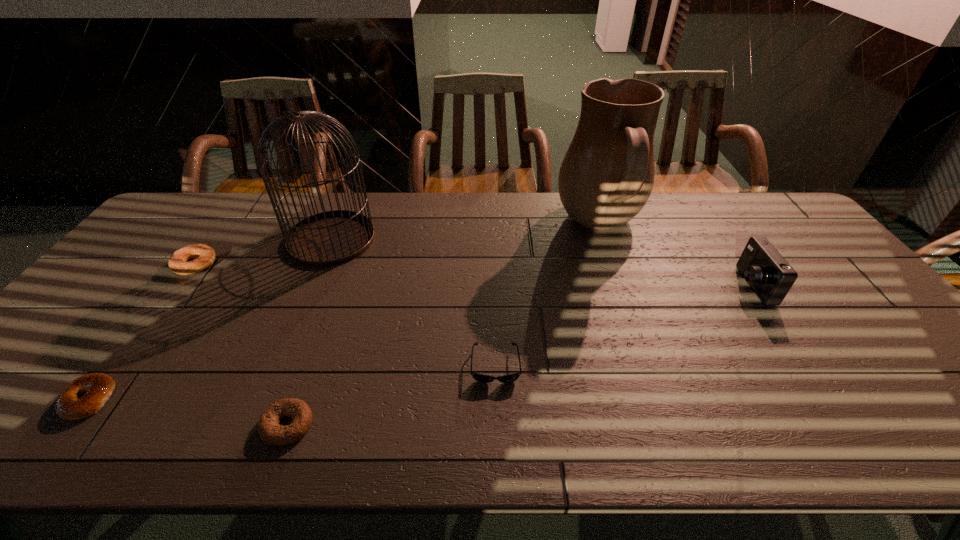
This screenshot has width=960, height=540. Find the location of `cream pitcher`. cream pitcher is located at coordinates (607, 175).

You are a GUI agent. You are given a task and a screenshot of the screen. Output one action in this format:
    pyautogui.click(x=<x>, y=<y>)
    Task: Click on the birdcage
    
    Given the screenshot: What is the action you would take?
    pyautogui.click(x=329, y=238)

Locate an element on the screen. the third tallest object is located at coordinates (770, 276).

Locate an element on the screen. the rightmost object is located at coordinates (770, 276).

Find the location of `the tallest bagel`. the tallest bagel is located at coordinates (205, 255).

At what (x,y) coordinates should I click in order to perform the action: click on sunglasses. Please return your answer as a coordinate pair (x, y). Looking at the image, I should click on (482, 378).

At what (x,y) coordinates should I click in order to perform the action: click on the rightmost bagel. Please return your answer as a coordinate pair (x, y). The image size is (960, 540). Looking at the image, I should click on (269, 430).

Where is `free space located at the spout of the cream pitcher`? The height and width of the screenshot is (540, 960). free space located at the spout of the cream pitcher is located at coordinates (526, 227).

Identify the location of vacant space situated at the spout of the cream pitcher. (535, 227).

You are a GUI agent. You are given a task and a screenshot of the screen. Output one action in this format:
    pyautogui.click(x=<x>, y=<y>)
    Task: Click on the vacant space located 0.350m at the spout of the cream pitcher
    This screenshot has width=960, height=540.
    Given the screenshot: What is the action you would take?
    pyautogui.click(x=450, y=227)